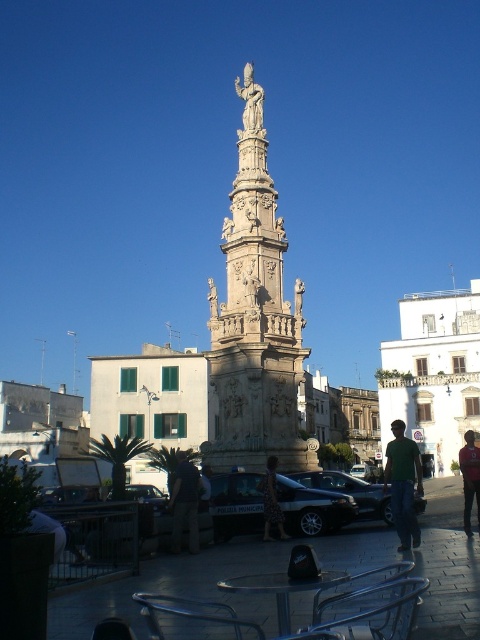
Question: Which point appears closest to the camera in this image?

Choices:
 (A) (227, 362)
 (B) (261, 128)

Answer: (A)

Question: From the image, what is the correct spatial relationship of shiny black sedan at center in relation to dark red fabric jacket at center?

Choices:
 (A) right
 (B) left

Answer: (B)

Question: Which of the following is the farthest from the observer?

Choices:
 (A) (175, 532)
 (B) (463, 449)

Answer: (B)

Question: Is beige stone column at center below green matte shirt at center?

Choices:
 (A) yes
 (B) no

Answer: (B)

Question: Which object appears closest to the camera in this image?

Choices:
 (A) white stone statue at upper center
 (B) beige stone column at center
 (C) dark red fabric jacket at center
 (D) shiny black sedan at center

Answer: (D)

Question: Can you confirm if shiny black sedan at center is wider than metallic silver car at center?

Choices:
 (A) no
 (B) yes

Answer: (B)